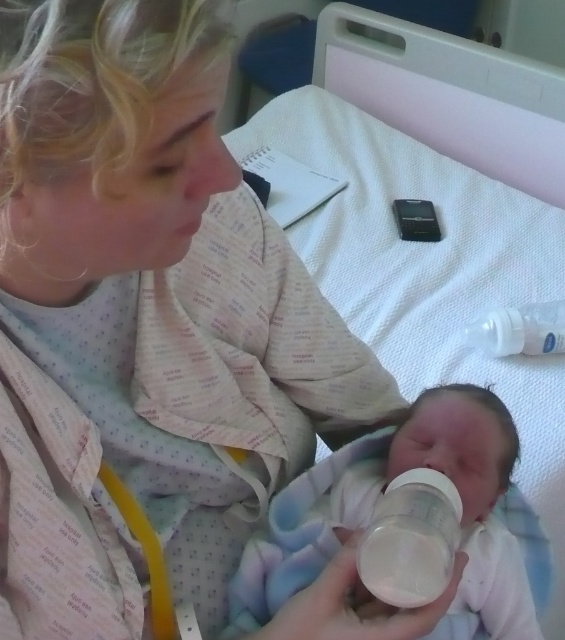
Question: Among these objects, which one is nearest to the camera?

Choices:
 (A) white matte baby bottle at center
 (B) transparent plastic bottle at upper right

Answer: (A)

Question: Among these objects, which one is nearest to the camera?

Choices:
 (A) transparent plastic bottle at center
 (B) transparent plastic bottle at upper right

Answer: (A)

Question: Is transparent plastic bottle at center below transparent plastic bottle at upper right?

Choices:
 (A) no
 (B) yes

Answer: (B)

Question: Observing the image, what is the correct spatial positioning of transparent plastic bottle at center in reference to white matte baby bottle at center?

Choices:
 (A) left
 (B) right

Answer: (B)

Question: Which is nearer to the white matte baby bottle at center?

Choices:
 (A) transparent plastic bottle at upper right
 (B) transparent plastic bottle at center

Answer: (B)

Question: Is white matte baby bottle at center in front of transparent plastic bottle at upper right?

Choices:
 (A) no
 (B) yes

Answer: (B)